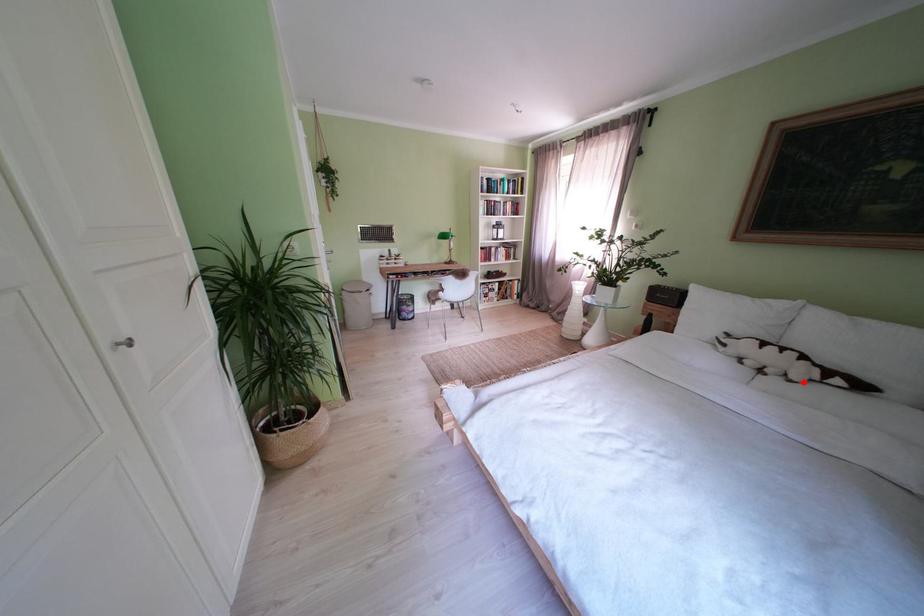
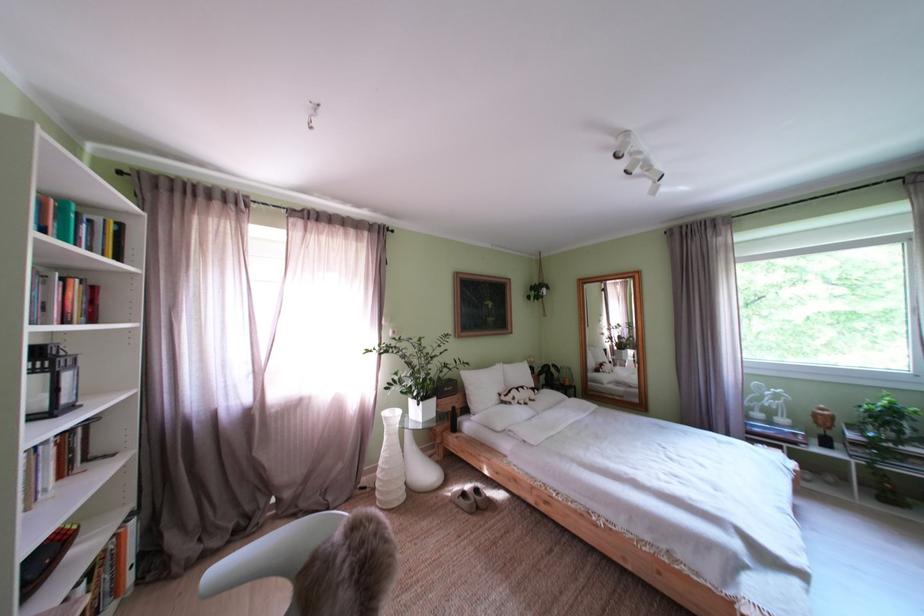
Question: I am providing you with two images of the same scene from different viewpoints. In image1, a red point is highlighted. Considering the same 3D point in image2, which of the following is correct?

Choices:
 (A) It is closer
 (B) It is farther

Answer: (B)